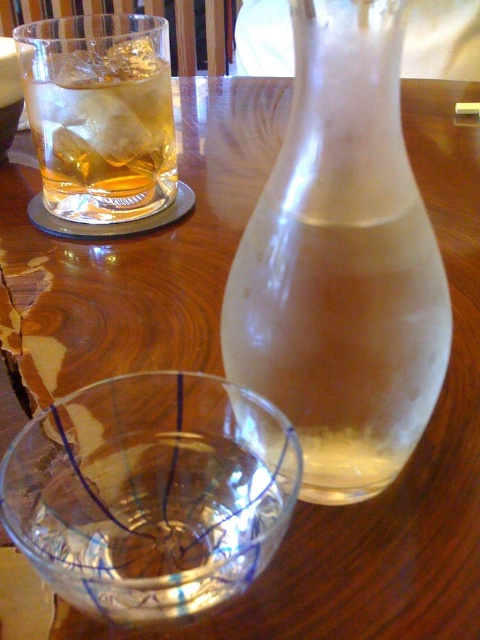
Who is higher up, transparent glass carafe at center or amber glass at upper left?

Positioned higher is amber glass at upper left.

Where is `transparent glass carafe at center`? This screenshot has height=640, width=480. transparent glass carafe at center is located at coordinates (342, 262).

Is point (373, 72) positioned in front of point (52, 100)?

Yes, it is in front of point (52, 100).

Locate an element on the screen. transparent glass carafe at center is located at coordinates (342, 262).

Which is in front, point (252, 500) or point (164, 72)?

Point (252, 500)

Is point (118, 483) farther from viewer compared to point (96, 216)?

That is False.

This screenshot has width=480, height=640. In order to click on transparent glass bowl at center in this screenshot , I will do `click(151, 493)`.

Looking at this image, is transparent glass carafe at center to the right of transparent glass bowl at center from the viewer's perspective?

Correct, you'll find transparent glass carafe at center to the right of transparent glass bowl at center.

Measure the distance between transparent glass carafe at center and transparent glass bowl at center.

The distance of transparent glass carafe at center from transparent glass bowl at center is 1.58 inches.

Is point (408, 234) more distant than point (135, 586)?

That is True.

At what (x,y) coordinates should I click in order to perform the action: click on transparent glass carafe at center. Please return your answer as a coordinate pair (x, y). The width and height of the screenshot is (480, 640). Looking at the image, I should click on (342, 262).